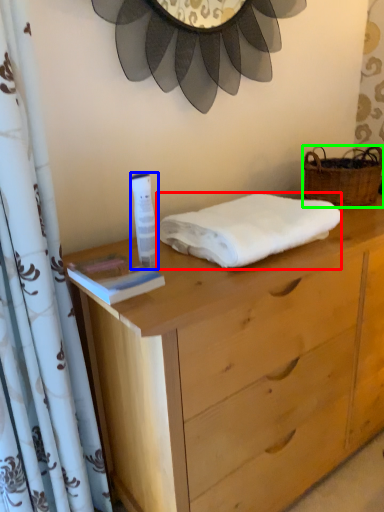
Question: Estimate the real-world distances between objects in this image. Which object is closer to towel (highlighted by a red box), toiletry (highlighted by a blue box) or picnic basket (highlighted by a green box)?

Choices:
 (A) toiletry
 (B) picnic basket

Answer: (A)